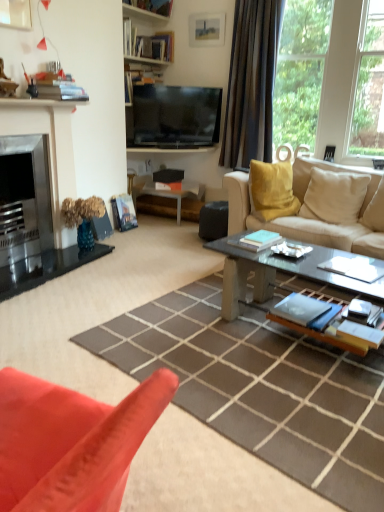
Question: From the image's perspective, does white glossy side table at center appear higher than brown fabric curtain at right?

Choices:
 (A) yes
 (B) no

Answer: (B)

Question: Is the depth of white glossy side table at center greater than that of brown fabric curtain at right?

Choices:
 (A) yes
 (B) no

Answer: (A)

Question: Considering the relative sizes of white glossy side table at center and brown fabric curtain at right in the image provided, is white glossy side table at center wider than brown fabric curtain at right?

Choices:
 (A) no
 (B) yes

Answer: (B)

Question: Is there a large distance between white glossy side table at center and brown fabric curtain at right?

Choices:
 (A) yes
 (B) no

Answer: (A)

Question: From the image's perspective, does white glossy side table at center appear lower than brown fabric curtain at right?

Choices:
 (A) no
 (B) yes

Answer: (B)

Question: Can you confirm if white glossy side table at center is smaller than brown fabric curtain at right?

Choices:
 (A) yes
 (B) no

Answer: (A)

Question: From the image's perspective, is wooden bookshelf at upper center over brown fabric curtain at right?

Choices:
 (A) no
 (B) yes

Answer: (B)

Question: Is wooden bookshelf at upper center bigger than brown fabric curtain at right?

Choices:
 (A) no
 (B) yes

Answer: (A)

Question: Can you confirm if wooden bookshelf at upper center is thinner than brown fabric curtain at right?

Choices:
 (A) yes
 (B) no

Answer: (A)

Question: Does wooden bookshelf at upper center have a lesser height compared to brown fabric curtain at right?

Choices:
 (A) yes
 (B) no

Answer: (A)

Question: Is wooden bookshelf at upper center at the right side of brown fabric curtain at right?

Choices:
 (A) no
 (B) yes

Answer: (A)

Question: Is wooden bookshelf at upper center positioned behind brown fabric curtain at right?

Choices:
 (A) no
 (B) yes

Answer: (B)

Question: Does wooden bookshelf at upper center turn towards beige fabric couch at center?

Choices:
 (A) yes
 (B) no

Answer: (B)